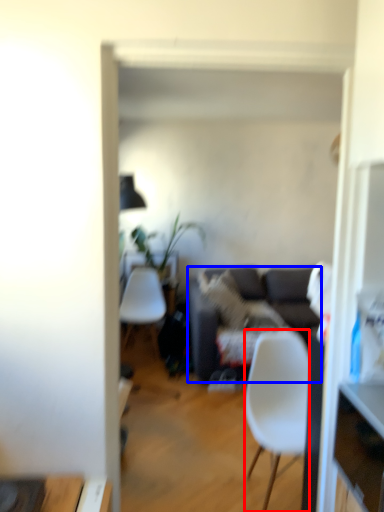
Question: Which object is further to the camera taking this photo, chair (highlighted by a red box) or studio couch (highlighted by a blue box)?

Choices:
 (A) chair
 (B) studio couch

Answer: (B)